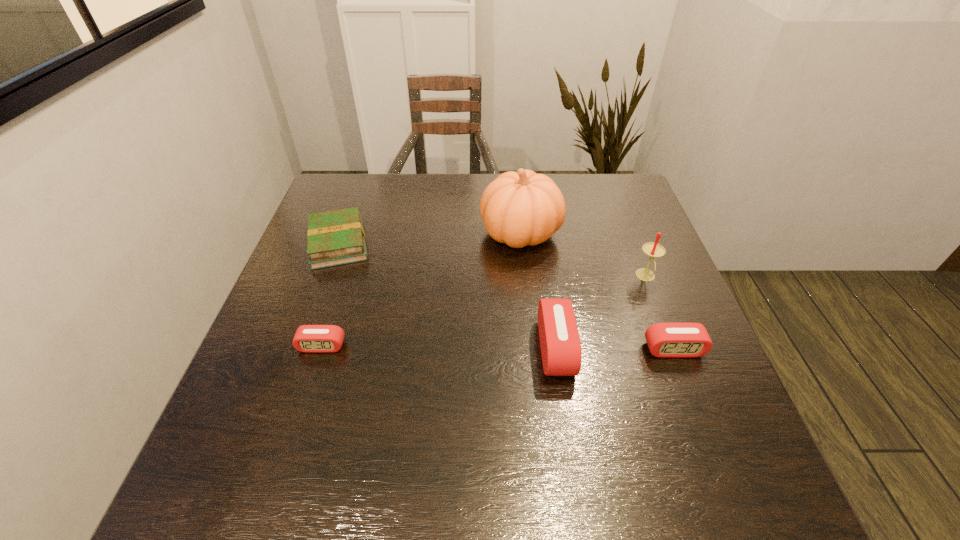
The height and width of the screenshot is (540, 960). I want to click on free space between the tallest object and the candle, so [583, 255].

Identify the location of unoccupied position between the second alarm clock from right to left and the second tallest alarm clock. The image size is (960, 540). (x=614, y=349).

You are a GUI agent. You are given a task and a screenshot of the screen. Output one action in this format:
    pyautogui.click(x=<x>, y=<y>)
    Task: Click on the free point between the third shortest object and the tallest alarm clock
    The image size is (960, 540).
    Given the screenshot: What is the action you would take?
    pyautogui.click(x=614, y=349)

Where is `vacant area that lies between the fourth shortest object and the pumpkin`? The height and width of the screenshot is (540, 960). vacant area that lies between the fourth shortest object and the pumpkin is located at coordinates (539, 291).

Identify the location of free area in between the shortest alarm clock and the second shortest alarm clock. The width and height of the screenshot is (960, 540). click(x=497, y=348).

Identify the location of object that can be found as the third closest to the second shortest alarm clock. The height and width of the screenshot is (540, 960). (521, 208).

This screenshot has width=960, height=540. I want to click on object identified as the second closest to the leftmost alarm clock, so click(x=521, y=208).

Find the location of `the second closest alarm clock relative to the third shortest object`. the second closest alarm clock relative to the third shortest object is located at coordinates 308,338.

I want to click on alarm clock that can be found as the closest to the shortest alarm clock, so click(x=561, y=353).

The width and height of the screenshot is (960, 540). I want to click on free space that satisfies the following two spatial constraints: 1. on the back side of the tallest object; 2. on the right side of the book, so click(342, 233).